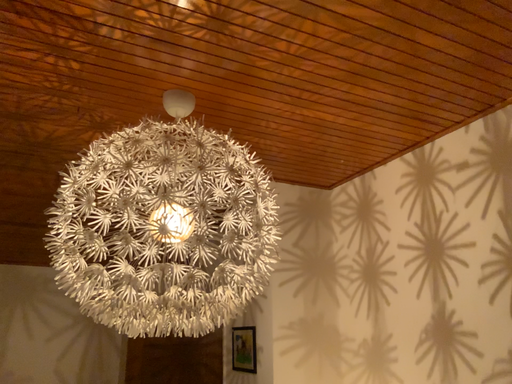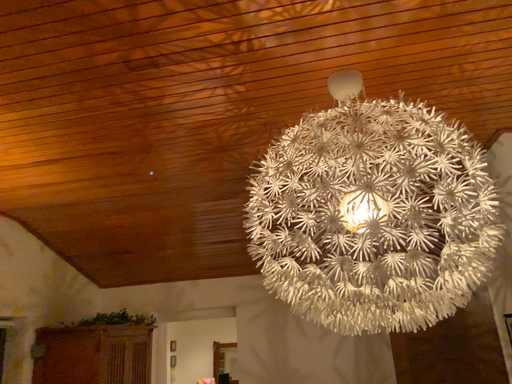
Question: How did the camera likely rotate when shooting the video?

Choices:
 (A) rotated right
 (B) rotated left

Answer: (B)